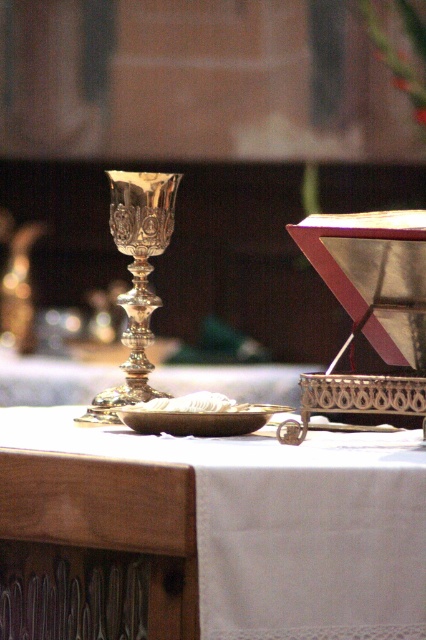
Based on the photo, which of these two, polished silver goblet at center or matte gold plate at center, stands taller?

polished silver goblet at center is taller.

Is point (143, 234) farther from camera compared to point (252, 412)?

Yes, it is.

Locate an element on the screen. The height and width of the screenshot is (640, 426). polished silver goblet at center is located at coordinates (137, 276).

Consider the image. Who is taller, white lace cloth at center or polished silver goblet at center?

Standing taller between the two is polished silver goblet at center.

The width and height of the screenshot is (426, 640). Describe the element at coordinates (282, 524) in the screenshot. I see `white lace cloth at center` at that location.

I want to click on white lace cloth at center, so click(282, 524).

Is white lace cloth at center wider than matte gold plate at center?

Yes, white lace cloth at center is wider than matte gold plate at center.

Can you confirm if white lace cloth at center is positioned below matte gold plate at center?

Yes.

Which is in front, point (305, 461) or point (192, 433)?

Positioned in front is point (305, 461).

The image size is (426, 640). I want to click on white lace cloth at center, so click(x=282, y=524).